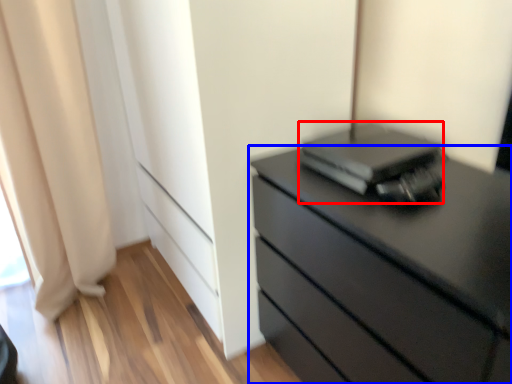
Question: Among these objects, which one is nearest to the camera, computer (highlighted by a red box) or chest of drawers (highlighted by a blue box)?

Choices:
 (A) computer
 (B) chest of drawers

Answer: (B)